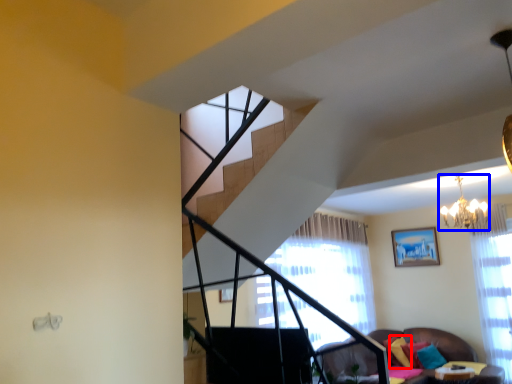
Question: Which object appears farthest to the camera in this image, pillow (highlighted by a red box) or light fixture (highlighted by a blue box)?

Choices:
 (A) pillow
 (B) light fixture

Answer: (A)